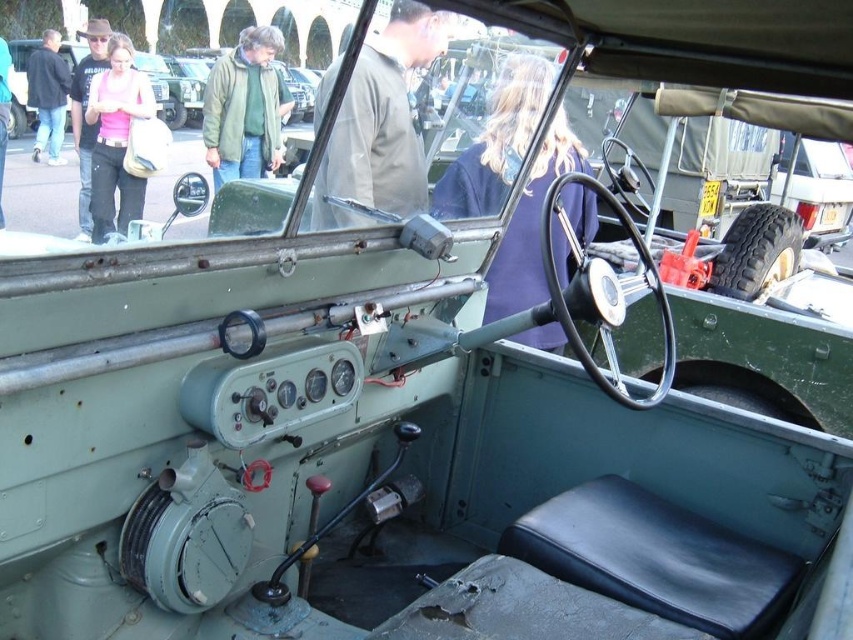
You are inside the vintage military vehicle and need to reach a control panel located at point (190, 76). However, there is an obstacle at point (57, 161). Can you reach the control panel without moving around the obstacle?

Point (190, 76) is behind point (57, 161), so you can reach the control panel at point (190, 76) without moving around the obstacle at point (57, 161) because it is positioned behind it and not blocking the path.

From the picture: You are standing 3 meters away from the vintage military vehicle. If you want to reach the point at coordinates point (300,93) inside the vehicle, can you do so without moving closer than your current position?

The distance of point (300,93) from viewer is 3.74 meters. Since you are currently 3 meters away, you need to move 0.74 meters closer to reach the point, so you cannot do it without moving closer than your current position.

You are a soldier in a military vehicle and need to reach the blue fabric at center to retrieve a map. The map is 1.8 meters away from your current position. Can you safely reach it without moving your position?

The blue fabric at center is 2.09 meters from camera, which is farther than the 1.8 meters you can reach. Therefore, you cannot safely reach it without moving your position.